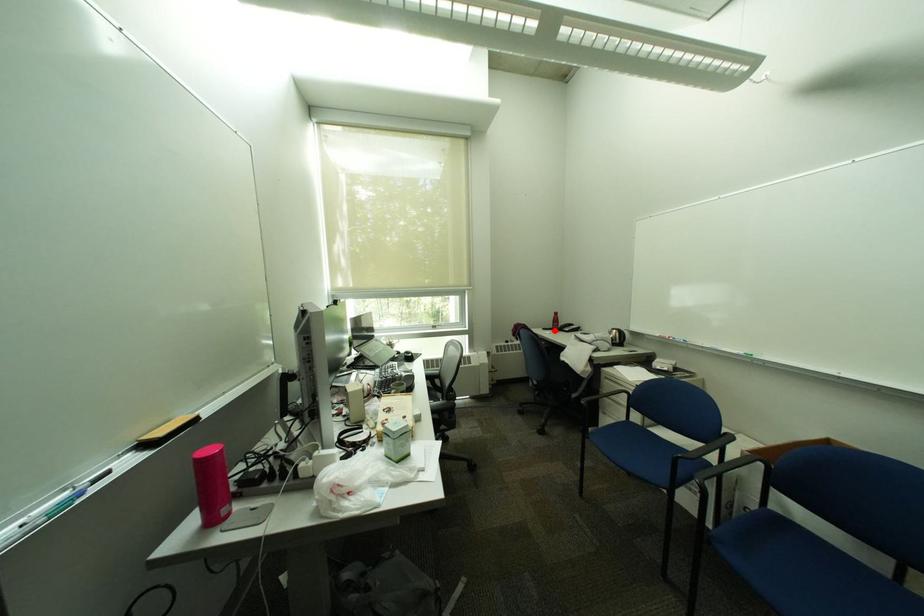
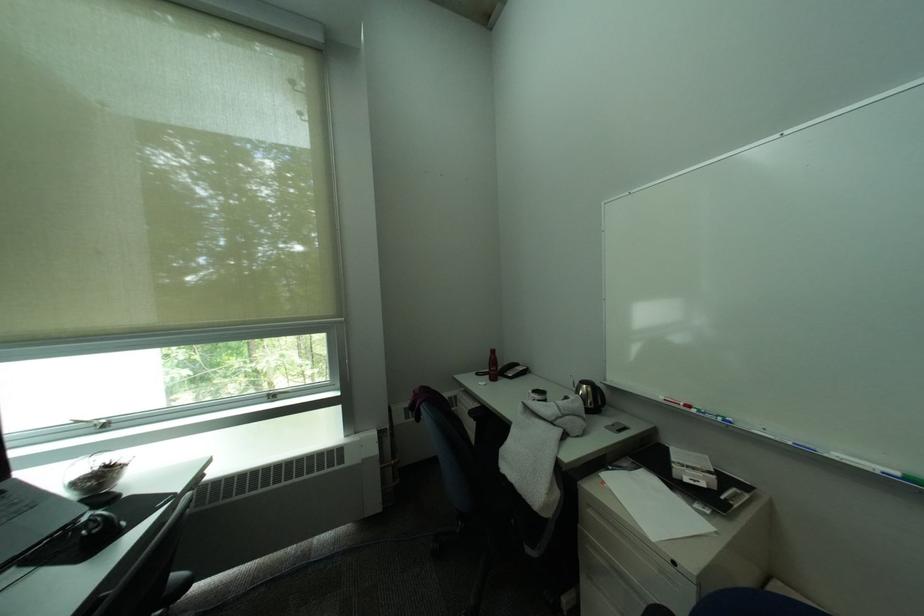
Locate, in the second image, the point that corresponds to the highlighted location in the first image.

(488, 376)